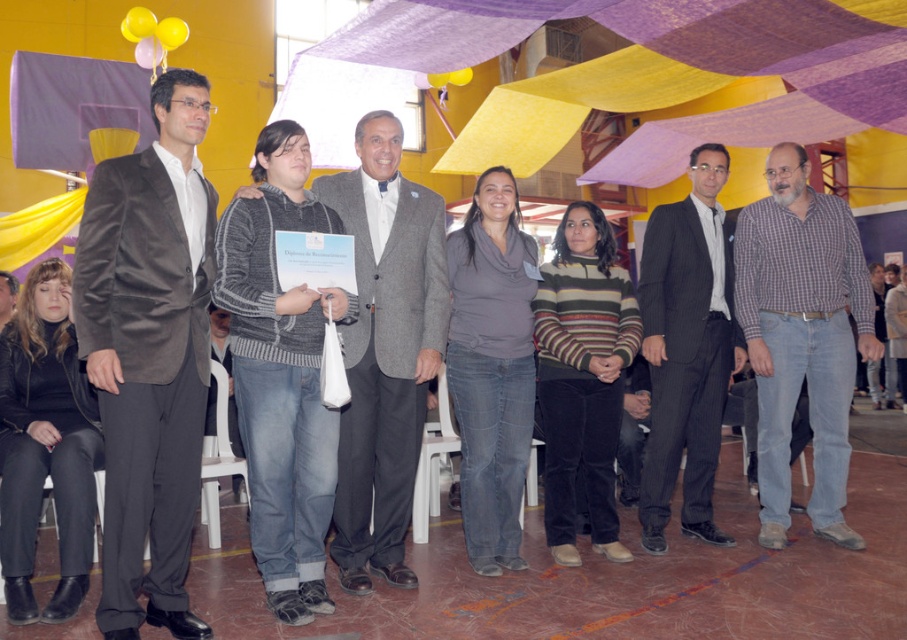
Based on the scene description, where is the knitted sweater at center located in terms of coordinates?

The knitted sweater at center is located at point [281,374].

You are a photographer at a formal event. You need to capture a photo of the plaid cotton shirt at right and the black leather jacket at lower left. Which one will appear larger in the photo?

The plaid cotton shirt at right is much taller than the black leather jacket at lower left, so it will appear larger in the photo.

You are standing at the origin point in the center of the hall. You need to deliver a message to two people located at point A and point B. Point A is at coordinates point(272,173) and point B is at point(659,550). Given that you can only move forward in a straight line, which point should you aim for first to reach the person closer to you?

Point A at point(272,173) is closer to you than point B at point(659,550) because it is in front of point B. Therefore, you should aim for point A first.